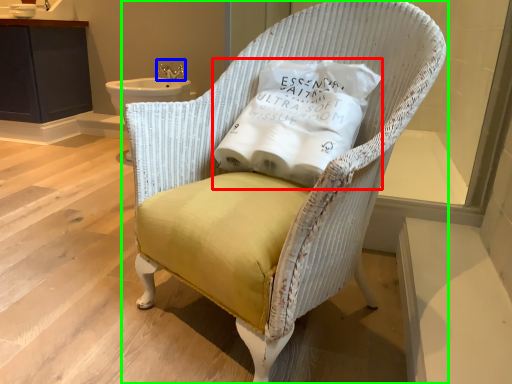
Question: Which is farther away from pillow (highlighted by a red box)? faucet (highlighted by a blue box) or chair (highlighted by a green box)?

Choices:
 (A) faucet
 (B) chair

Answer: (A)